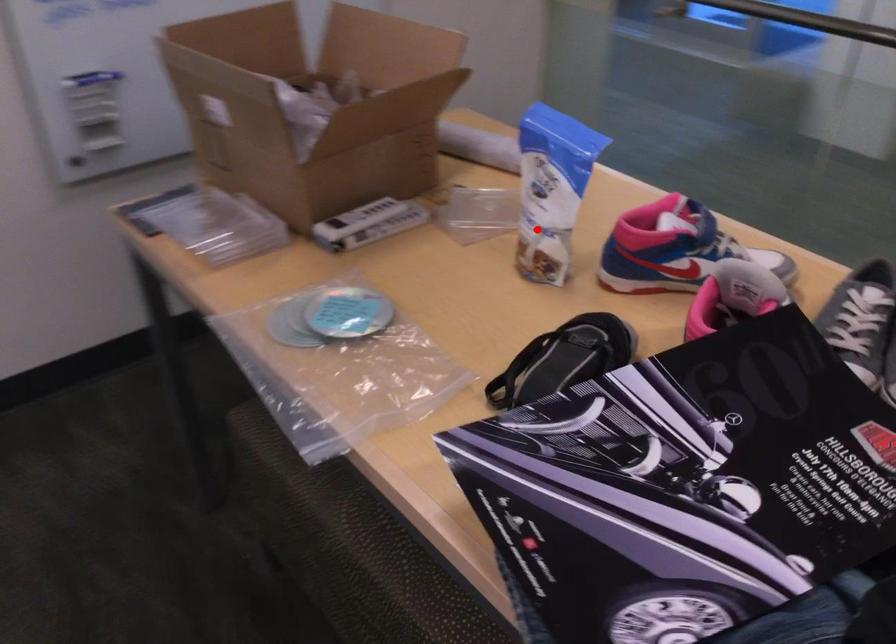
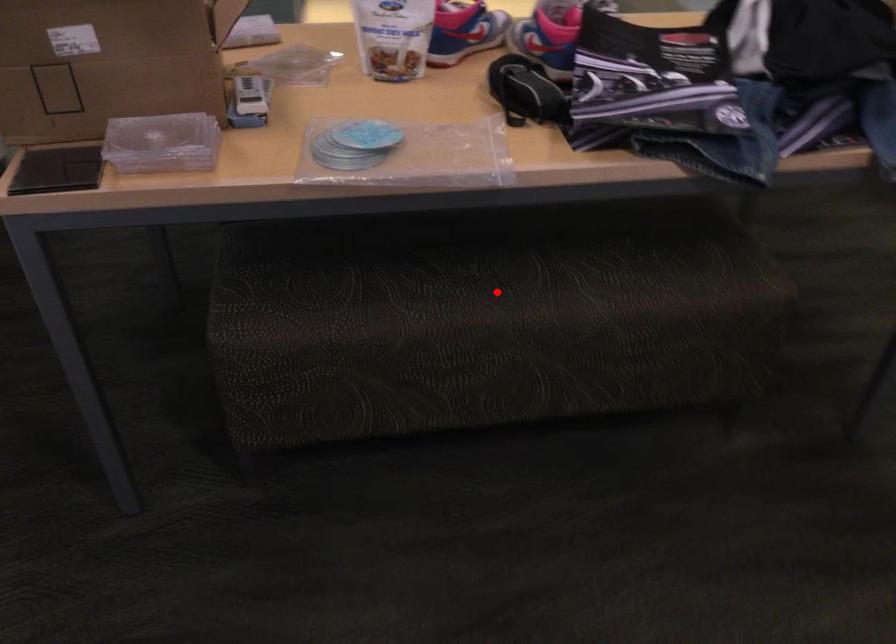
In the scene shown: I am providing you with two images of the same scene from different viewpoints. A red point is marked on the first image and another point is marked on the second image. Is the marked point in image1 the same physical position as the marked point in image2?

No